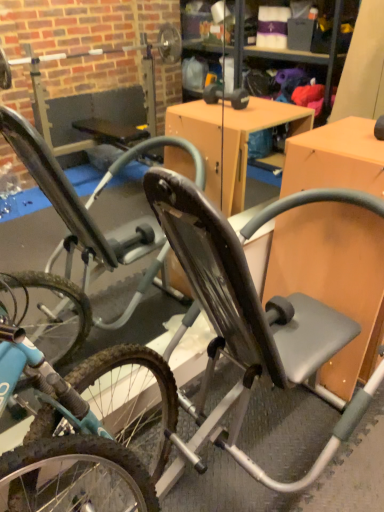
At what (x,y) coordinates should I click in order to perform the action: click on free space above matte orange table at center (from a real-world perspective). Please return your answer as a coordinate pair (x, y). This screenshot has width=384, height=512. Looking at the image, I should click on (355, 143).